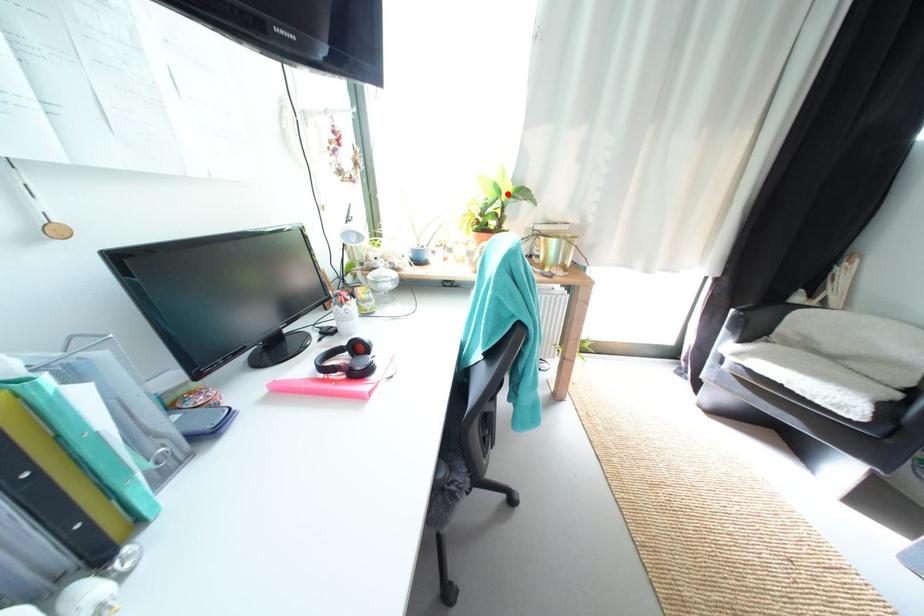
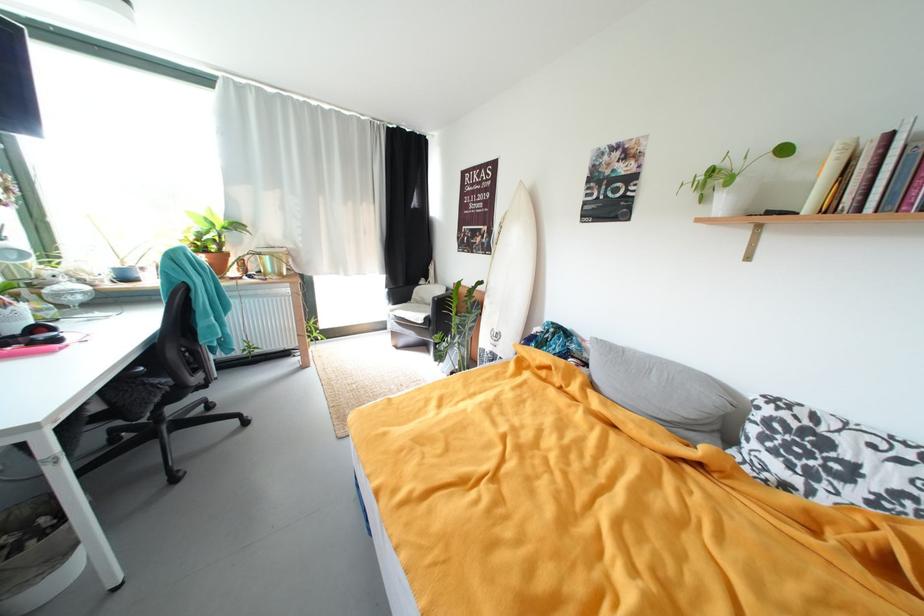
Find the pixel in the second image that matches the highlighted location in the first image.

(221, 225)